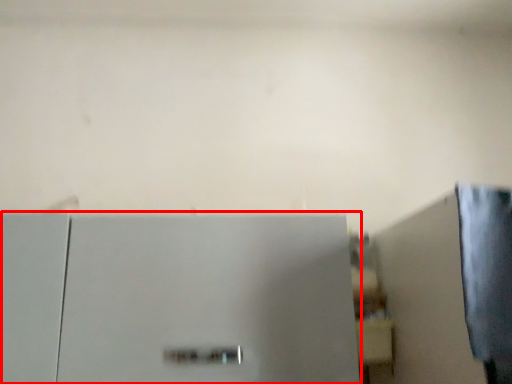
Question: From the image's perspective, considering the relative positions of refrigerator (annotated by the red box) and shelf in the image provided, where is refrigerator (annotated by the red box) located with respect to the staircase?

Choices:
 (A) below
 (B) above

Answer: (A)